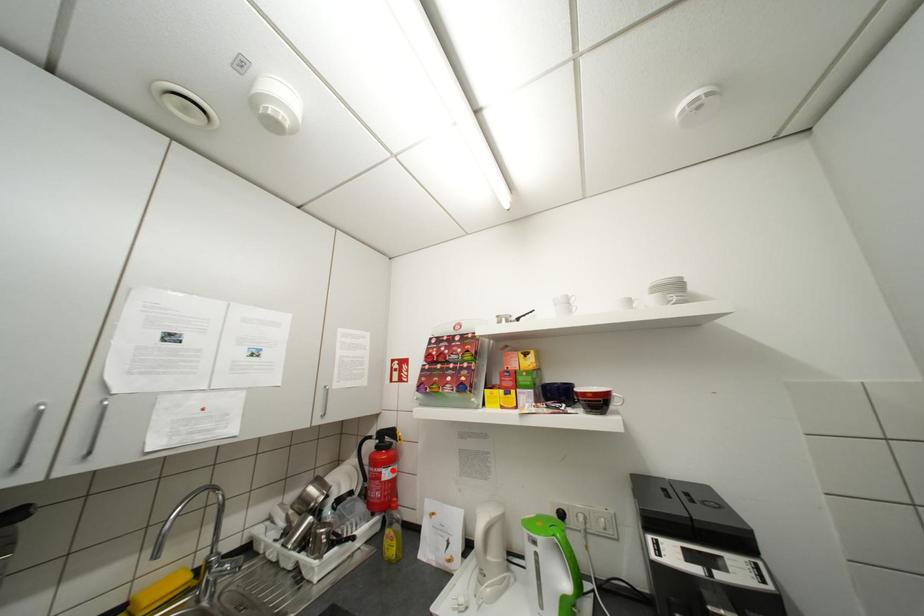
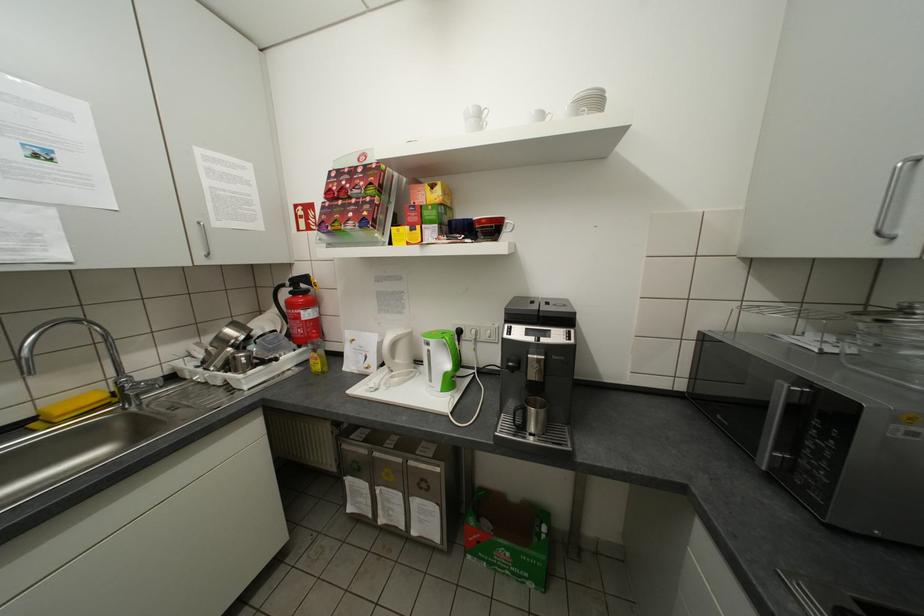
Question: A red point is marked in image1. In image2, is the corresponding 3D point closer to the camera or farther? Reply with the corresponding letter.

Choices:
 (A) The corresponding 3D point is closer.
 (B) The corresponding 3D point is farther.

Answer: (A)